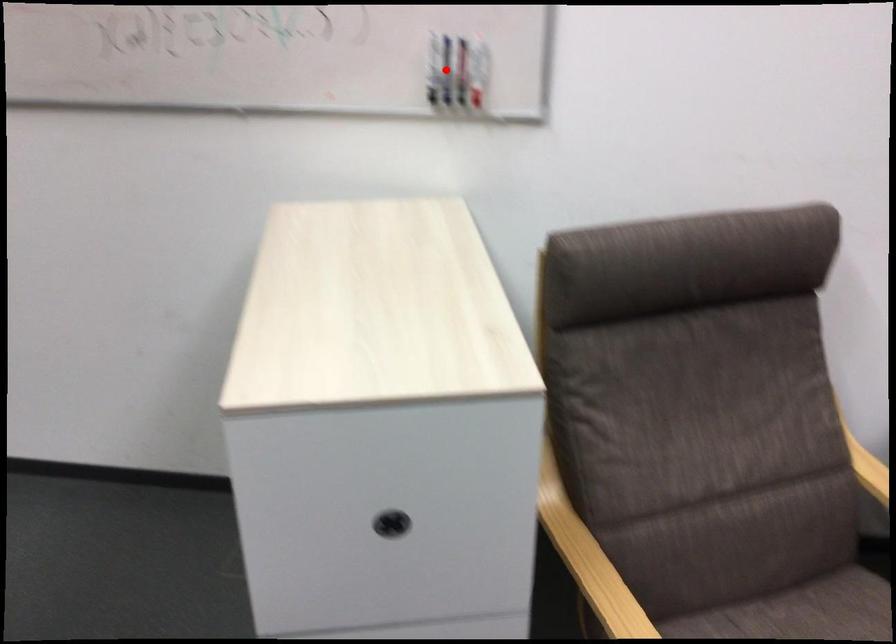
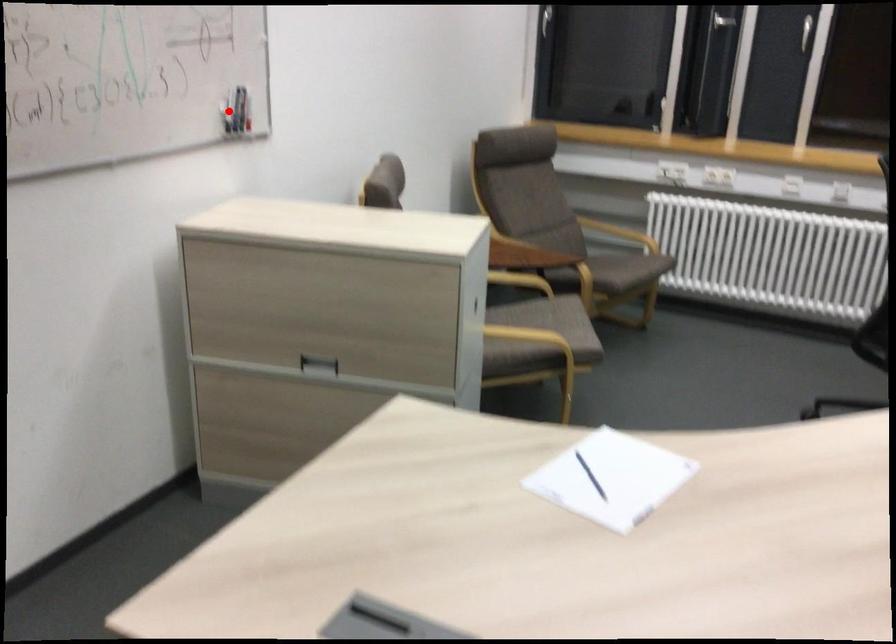
I am providing you with two images of the same scene from different viewpoints. A red point is marked on the first image and another point is marked on the second image. Does the point marked in image1 correspond to the same location as the one in image2?

Yes